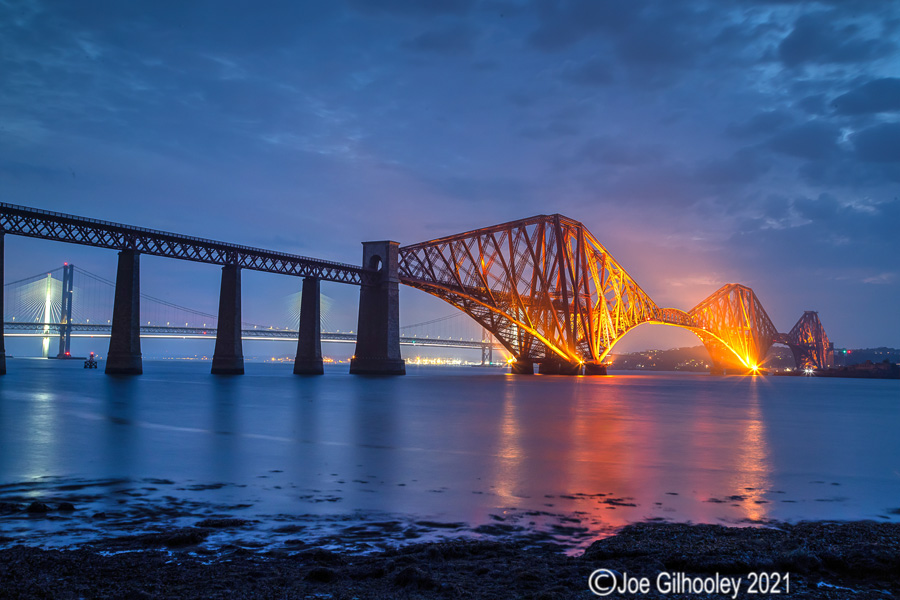
Find the location of a particular element. Image resolution: width=900 pixels, height=600 pixels. light is located at coordinates (757, 366).